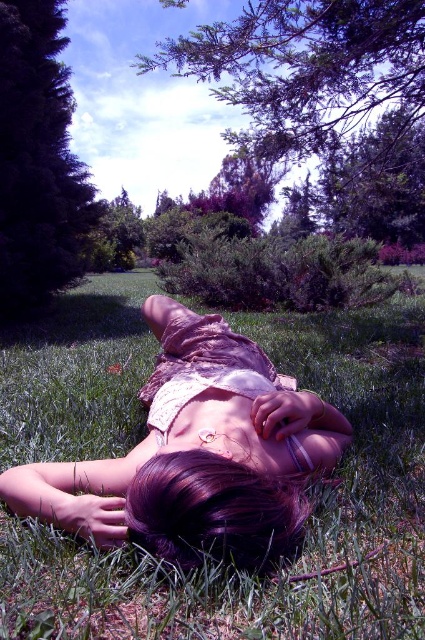
You are a photographer trying to capture the pink lace dress at center in the image. The camera you are using has a focal length of 50mm and an aperture of f2.8. The dress is located at coordinates point 0.711, 0.466. Where exactly in the frame should you position the dress to ensure it is centered in your shot?

To center the pink lace dress at center in the frame, position it at the coordinates point (198, 454), which is already the center point of the image.

You are a photographer planning to take a portrait of the person in the scene. Given that the pink lace dress at center and dark purple hair at center are both visible, which object would you focus on to ensure the subject is fully captured in the frame?

The pink lace dress at center has a greater width than the dark purple hair at center, so focusing on the pink lace dress at center would ensure the subject is fully captured in the frame.

You are a photographer trying to capture a portrait of the person in the pink lace dress at center and dark purple hair at center. Since you want to ensure the dress is visible without being obscured by the hair, which object should you focus on first?

The pink lace dress at center is taller than dark purple hair at center, so you should focus on the pink lace dress at center first to ensure it remains visible and not blocked by the hair.